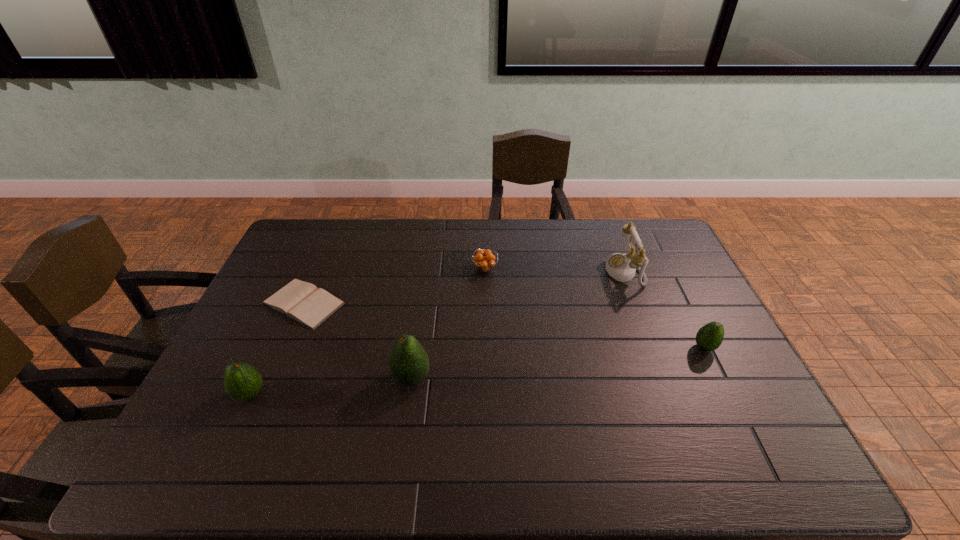
Locate an element on the screen. free space at the far left corner of the desktop is located at coordinates (308, 224).

This screenshot has height=540, width=960. Find the location of `free location at the far right corner`. free location at the far right corner is located at coordinates (672, 243).

Identify the location of vacant region between the shortest object and the farthest avocado. (504, 325).

Where is `free space between the fourth object from left to right and the Bible`? free space between the fourth object from left to right and the Bible is located at coordinates (395, 286).

This screenshot has height=540, width=960. Identify the location of empty space between the rightmost object and the telephone. (664, 309).

At what (x,y) coordinates should I click in order to perform the action: click on free space that is in between the third tallest object and the orange fruit. Please return your answer as a coordinate pair (x, y). Image resolution: width=960 pixels, height=540 pixels. Looking at the image, I should click on (368, 332).

Find the location of a particular element. This screenshot has width=960, height=540. vacant region between the fourth tallest object and the third object from right to left is located at coordinates (594, 308).

Locate an element on the screen. free space between the second object from right to left and the second shortest object is located at coordinates (555, 270).

Where is `free space between the shortest avocado and the telephone`? free space between the shortest avocado and the telephone is located at coordinates (664, 309).

You are a GUI agent. You are given a task and a screenshot of the screen. Output one action in this format:
    pyautogui.click(x=<x>, y=<y>)
    Task: Click on the vacant point located between the third object from right to left and the shortest avocado
    
    Given the screenshot: What is the action you would take?
    (594, 308)